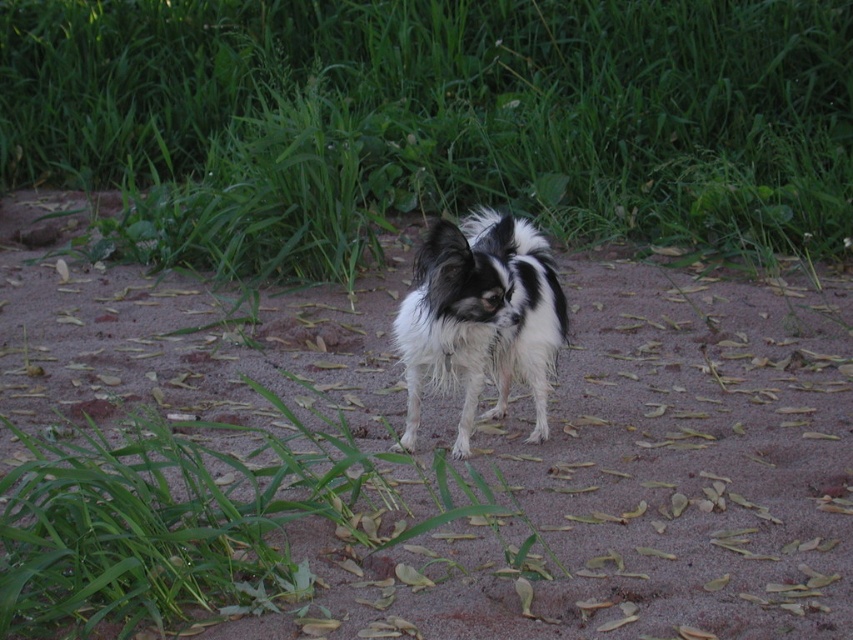
Question: Is brown sandy ground at center smaller than fluffy black-and-white dog at center?

Choices:
 (A) yes
 (B) no

Answer: (B)

Question: Which of these objects is positioned closest to the brown sandy ground at center?

Choices:
 (A) fluffy black-and-white dog at center
 (B) green leafy grass at center

Answer: (A)

Question: Which of the following is the farthest from the observer?

Choices:
 (A) brown sandy ground at center
 (B) green leafy grass at center
 (C) fluffy black-and-white dog at center

Answer: (B)

Question: Which point is farther to the camera?

Choices:
 (A) (566, 422)
 (B) (500, 344)
 (C) (117, 28)

Answer: (C)

Question: Is green leafy grass at center thinner than brown sandy ground at center?

Choices:
 (A) no
 (B) yes

Answer: (B)

Question: Is green leafy grass at center below fluffy black-and-white dog at center?

Choices:
 (A) yes
 (B) no

Answer: (B)